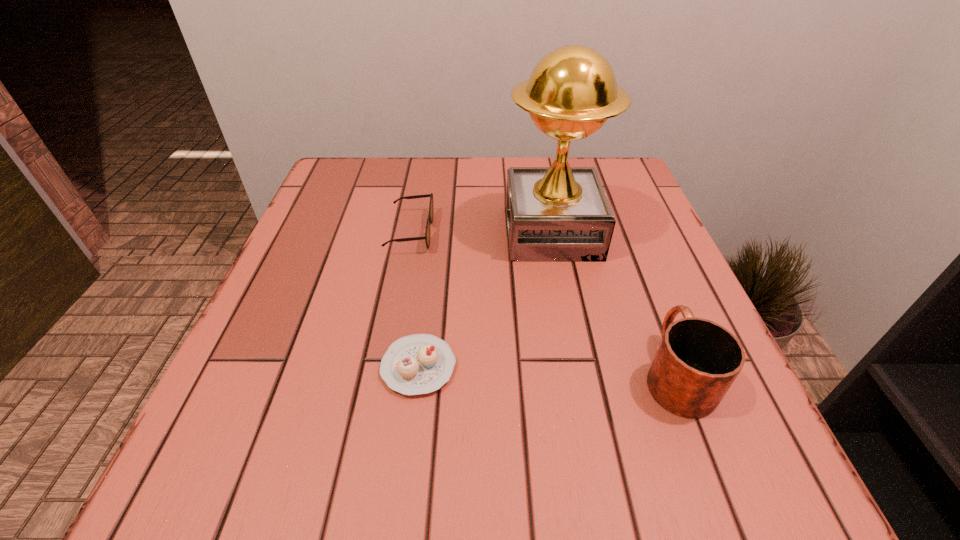
The image size is (960, 540). Identify the location of free space between the tallest object and the second shortest object. (481, 232).

What are the coordinates of `unoccupied position between the cupcake and the third shortest object` in the screenshot? It's located at (547, 370).

Identify the location of vacant area that lies between the third tallest object and the tallest object. (481, 232).

Find the location of a particular element. This screenshot has width=960, height=540. object that is the closest one to the mug is located at coordinates (560, 213).

This screenshot has width=960, height=540. I want to click on the second closest object relative to the third shortest object, so click(x=416, y=364).

Where is `vacant space that satisfies the following two spatial constraints: 1. on the front-facing side of the third tallest object; 2. on the side of the third shortest object with the handle`? The width and height of the screenshot is (960, 540). vacant space that satisfies the following two spatial constraints: 1. on the front-facing side of the third tallest object; 2. on the side of the third shortest object with the handle is located at coordinates (384, 373).

Locate an element on the screen. free spot that satisfies the following two spatial constraints: 1. on the front-facing side of the cupcake; 2. on the right side of the sunglasses is located at coordinates (385, 367).

At what (x,y) coordinates should I click in order to perform the action: click on vacant space that satisfies the following two spatial constraints: 1. on the front-facing side of the tallest object; 2. on the front side of the cupcake. Please return your answer as a coordinate pair (x, y). Image resolution: width=960 pixels, height=540 pixels. Looking at the image, I should click on (578, 367).

Identify the location of vacant space that satisfies the following two spatial constraints: 1. on the front-facing side of the cupcake; 2. on the right side of the sunglasses. (385, 367).

This screenshot has width=960, height=540. I want to click on free space in the image that satisfies the following two spatial constraints: 1. on the side of the mug with the handle; 2. on the front-facing side of the sunglasses, so click(622, 232).